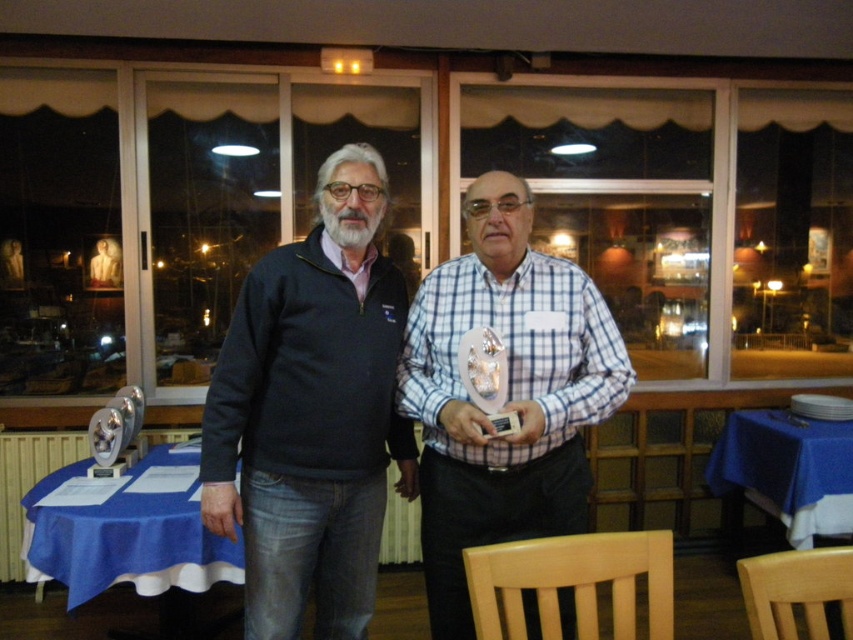
Question: Which object is positioned closest to the blue fabric table at lower left?

Choices:
 (A) white checkered shirt at center
 (B) blue cloth table at lower right

Answer: (A)

Question: Which point appears closest to the camera in this image?

Choices:
 (A) (158, 534)
 (B) (505, 273)

Answer: (B)

Question: Can you confirm if white checkered shirt at center is positioned below blue fabric table at lower left?

Choices:
 (A) no
 (B) yes

Answer: (A)

Question: Observing the image, what is the correct spatial positioning of dark blue sweater at center in reference to white checkered shirt at center?

Choices:
 (A) below
 (B) above

Answer: (B)

Question: Which point is farther to the camera?

Choices:
 (A) blue fabric table at lower left
 (B) blue cloth table at lower right
 (C) dark blue sweater at center

Answer: (B)

Question: Can you confirm if dark blue sweater at center is positioned above blue cloth table at lower right?

Choices:
 (A) yes
 (B) no

Answer: (A)